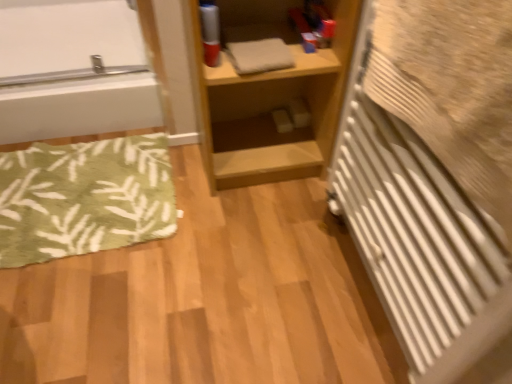
You are a GUI agent. You are given a task and a screenshot of the screen. Output one action in this format:
    pyautogui.click(x=<x>, y=<y>)
    Task: Click on the free area in between light wood shelf at center and white textured radiator at right
    
    Given the screenshot: What is the action you would take?
    pyautogui.click(x=287, y=243)